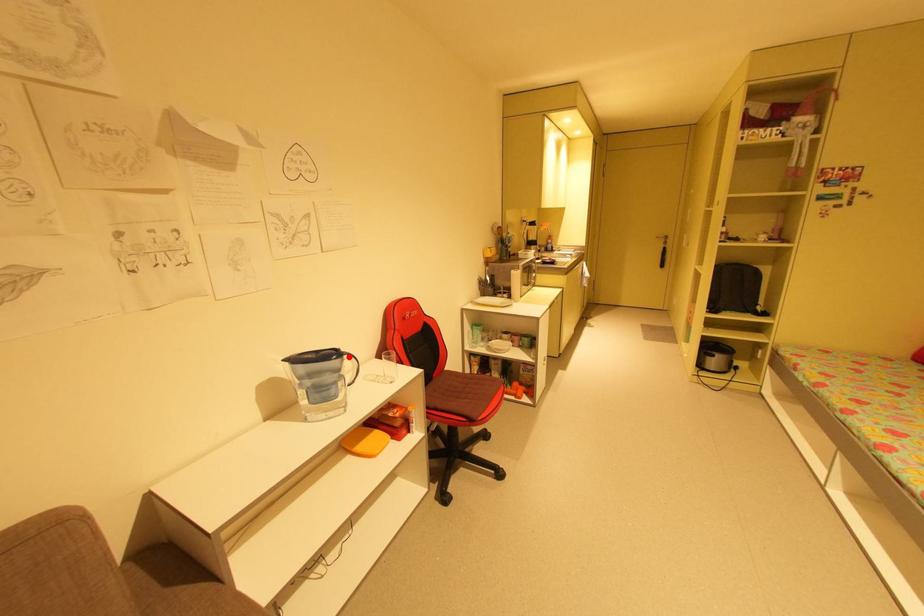
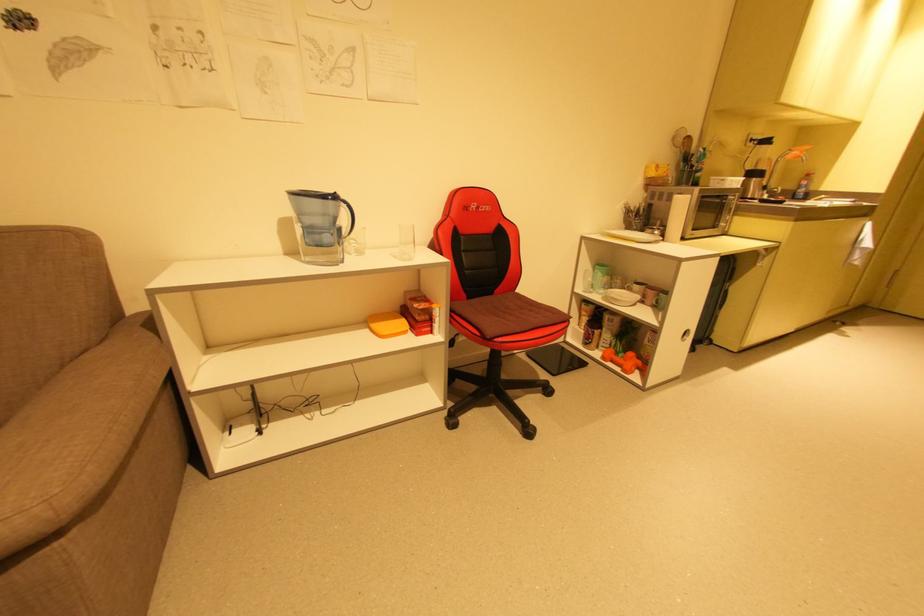
The point at the highlighted location is marked in the first image. Where is the corresponding point in the second image?

(346, 204)